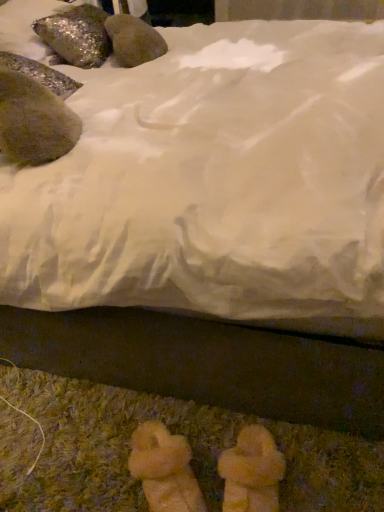
The height and width of the screenshot is (512, 384). Describe the element at coordinates (34, 121) in the screenshot. I see `shiny metallic rock at left, arranged as the 2th animal when viewed from the back` at that location.

You are a GUI agent. You are given a task and a screenshot of the screen. Output one action in this format:
    pyautogui.click(x=<x>, y=<y>)
    Task: Click on the shiny metallic rock at left, the 2th animal in the top-to-bottom sequence
    The width and height of the screenshot is (384, 512).
    Given the screenshot: What is the action you would take?
    pyautogui.click(x=34, y=121)

Image resolution: width=384 pixels, height=512 pixels. What do you see at coordinates (76, 35) in the screenshot?
I see `shiny metallic rock at upper left, marked as the 2th animal in a front-to-back arrangement` at bounding box center [76, 35].

You are a GUI agent. You are given a task and a screenshot of the screen. Output one action in this format:
    pyautogui.click(x=<x>, y=<y>)
    Task: Click on the shiny metallic rock at upper left, placed as the 2th animal when sorted from bottom to top
    
    Given the screenshot: What is the action you would take?
    pyautogui.click(x=76, y=35)

This screenshot has height=512, width=384. I want to click on shiny metallic rock at left, placed as the 1th animal when sorted from bottom to top, so click(34, 121).

Is shiny metallic rock at upper left, marked as the 2th animal in a front-to-back arrangement, to the left or to the right of shiny metallic rock at left, arranged as the 2th animal when viewed from the back, in the image?

Clearly, shiny metallic rock at upper left, marked as the 2th animal in a front-to-back arrangement, is on the left of shiny metallic rock at left, arranged as the 2th animal when viewed from the back, in the image.

Does shiny metallic rock at upper left, marked as the 2th animal in a front-to-back arrangement, lie behind shiny metallic rock at left, placed as the 1th animal when sorted from bottom to top?

Yes, the depth of shiny metallic rock at upper left, marked as the 2th animal in a front-to-back arrangement, is greater than that of shiny metallic rock at left, placed as the 1th animal when sorted from bottom to top.

Considering the points (106, 56) and (42, 100), which point is in front, point (106, 56) or point (42, 100)?

The point (42, 100) is in front.

From the image's perspective, is shiny metallic rock at upper left, marked as the 2th animal in a front-to-back arrangement, on shiny metallic rock at left, placed as the 1th animal when sorted from bottom to top?

Yes, from the image's perspective, shiny metallic rock at upper left, marked as the 2th animal in a front-to-back arrangement, is on top of shiny metallic rock at left, placed as the 1th animal when sorted from bottom to top.

From a real-world perspective, does shiny metallic rock at upper left, positioned as the 1th animal in top-to-bottom order, sit lower than shiny metallic rock at left, arranged as the 1th animal when viewed from the front?

No, from a real-world perspective, shiny metallic rock at upper left, positioned as the 1th animal in top-to-bottom order, is not under shiny metallic rock at left, arranged as the 1th animal when viewed from the front.

Is shiny metallic rock at upper left, marked as the 2th animal in a front-to-back arrangement, wider or thinner than shiny metallic rock at left, the 2th animal in the top-to-bottom sequence?

In the image, shiny metallic rock at upper left, marked as the 2th animal in a front-to-back arrangement, appears to be wider than shiny metallic rock at left, the 2th animal in the top-to-bottom sequence.

Does shiny metallic rock at upper left, which is the first animal in back-to-front order, have a greater height compared to shiny metallic rock at left, placed as the 1th animal when sorted from bottom to top?

Yes.

Between shiny metallic rock at upper left, which is the first animal in back-to-front order, and shiny metallic rock at left, arranged as the 2th animal when viewed from the back, which one has smaller size?

With smaller size is shiny metallic rock at left, arranged as the 2th animal when viewed from the back.

Is shiny metallic rock at upper left, positioned as the 1th animal in top-to-bottom order, situated inside shiny metallic rock at left, arranged as the 1th animal when viewed from the front, or outside?

shiny metallic rock at upper left, positioned as the 1th animal in top-to-bottom order, is not enclosed by shiny metallic rock at left, arranged as the 1th animal when viewed from the front.

Is shiny metallic rock at upper left, which is the first animal in back-to-front order, placed right next to shiny metallic rock at left, arranged as the 2th animal when viewed from the back?

No, shiny metallic rock at upper left, which is the first animal in back-to-front order, is not in contact with shiny metallic rock at left, arranged as the 2th animal when viewed from the back.

Is shiny metallic rock at upper left, placed as the 2th animal when sorted from bottom to top, facing towards shiny metallic rock at left, placed as the 1th animal when sorted from bottom to top?

No, shiny metallic rock at upper left, placed as the 2th animal when sorted from bottom to top, is not facing towards shiny metallic rock at left, placed as the 1th animal when sorted from bottom to top.

Can you tell me how much shiny metallic rock at upper left, which is the first animal in back-to-front order, and shiny metallic rock at left, arranged as the 1th animal when viewed from the front, differ in facing direction?

There is a 2-degree angle between the facing directions of shiny metallic rock at upper left, which is the first animal in back-to-front order, and shiny metallic rock at left, arranged as the 1th animal when viewed from the front.

In the image, there is a shiny metallic rock at left, the 2th animal in the top-to-bottom sequence. Find the location of `animal above it (from the image's perspective)`. animal above it (from the image's perspective) is located at coordinates (76, 35).

Is shiny metallic rock at left, placed as the 1th animal when sorted from bottom to top, to the left of shiny metallic rock at upper left, marked as the 2th animal in a front-to-back arrangement, from the viewer's perspective?

No, shiny metallic rock at left, placed as the 1th animal when sorted from bottom to top, is not to the left of shiny metallic rock at upper left, marked as the 2th animal in a front-to-back arrangement.

In the scene shown: Considering the positions of objects shiny metallic rock at left, placed as the 1th animal when sorted from bottom to top, and shiny metallic rock at upper left, positioned as the 1th animal in top-to-bottom order, in the image provided, who is in front, shiny metallic rock at left, placed as the 1th animal when sorted from bottom to top, or shiny metallic rock at upper left, positioned as the 1th animal in top-to-bottom order,?

shiny metallic rock at left, placed as the 1th animal when sorted from bottom to top, is more forward.

Which is nearer, (x=7, y=140) or (x=67, y=33)?

Point (x=7, y=140)

Consider the image. From the image's perspective, which object appears higher, shiny metallic rock at left, arranged as the 2th animal when viewed from the back, or shiny metallic rock at upper left, placed as the 2th animal when sorted from bottom to top?

shiny metallic rock at upper left, placed as the 2th animal when sorted from bottom to top, appears higher in the image.

From a real-world perspective, is shiny metallic rock at left, placed as the 1th animal when sorted from bottom to top, physically located above or below shiny metallic rock at upper left, positioned as the 1th animal in top-to-bottom order?

Clearly, from a real-world perspective, shiny metallic rock at left, placed as the 1th animal when sorted from bottom to top, is below shiny metallic rock at upper left, positioned as the 1th animal in top-to-bottom order.

Does shiny metallic rock at left, arranged as the 2th animal when viewed from the back, have a greater width compared to shiny metallic rock at upper left, which is the first animal in back-to-front order?

In fact, shiny metallic rock at left, arranged as the 2th animal when viewed from the back, might be narrower than shiny metallic rock at upper left, which is the first animal in back-to-front order.

Does shiny metallic rock at left, placed as the 1th animal when sorted from bottom to top, have a greater height compared to shiny metallic rock at upper left, positioned as the 1th animal in top-to-bottom order?

In fact, shiny metallic rock at left, placed as the 1th animal when sorted from bottom to top, may be shorter than shiny metallic rock at upper left, positioned as the 1th animal in top-to-bottom order.

Based on their sizes in the image, would you say shiny metallic rock at left, arranged as the 2th animal when viewed from the back, is bigger or smaller than shiny metallic rock at upper left, marked as the 2th animal in a front-to-back arrangement?

Clearly, shiny metallic rock at left, arranged as the 2th animal when viewed from the back, is smaller in size than shiny metallic rock at upper left, marked as the 2th animal in a front-to-back arrangement.

Would you say shiny metallic rock at left, arranged as the 2th animal when viewed from the back, is inside or outside shiny metallic rock at upper left, placed as the 2th animal when sorted from bottom to top?

shiny metallic rock at left, arranged as the 2th animal when viewed from the back, is located beyond the bounds of shiny metallic rock at upper left, placed as the 2th animal when sorted from bottom to top.

Is there a large distance between shiny metallic rock at left, arranged as the 1th animal when viewed from the front, and shiny metallic rock at upper left, marked as the 2th animal in a front-to-back arrangement?

shiny metallic rock at left, arranged as the 1th animal when viewed from the front, is actually quite close to shiny metallic rock at upper left, marked as the 2th animal in a front-to-back arrangement.

Is shiny metallic rock at left, arranged as the 2th animal when viewed from the back, oriented away from shiny metallic rock at upper left, marked as the 2th animal in a front-to-back arrangement?

shiny metallic rock at left, arranged as the 2th animal when viewed from the back, is not turned away from shiny metallic rock at upper left, marked as the 2th animal in a front-to-back arrangement.

How different are the orientations of shiny metallic rock at left, the 2th animal in the top-to-bottom sequence, and shiny metallic rock at upper left, positioned as the 1th animal in top-to-bottom order, in degrees?

shiny metallic rock at left, the 2th animal in the top-to-bottom sequence, and shiny metallic rock at upper left, positioned as the 1th animal in top-to-bottom order, are facing 2 degrees away from each other.

The image size is (384, 512). In order to click on animal above the shiny metallic rock at left, arranged as the 1th animal when viewed from the front (from a real-world perspective) in this screenshot , I will do `click(76, 35)`.

The height and width of the screenshot is (512, 384). Find the location of `animal that appears on the right of shiny metallic rock at upper left, which is the first animal in back-to-front order`. animal that appears on the right of shiny metallic rock at upper left, which is the first animal in back-to-front order is located at coordinates (34, 121).

Locate an element on the screen. animal in front of the shiny metallic rock at upper left, which is the first animal in back-to-front order is located at coordinates (34, 121).